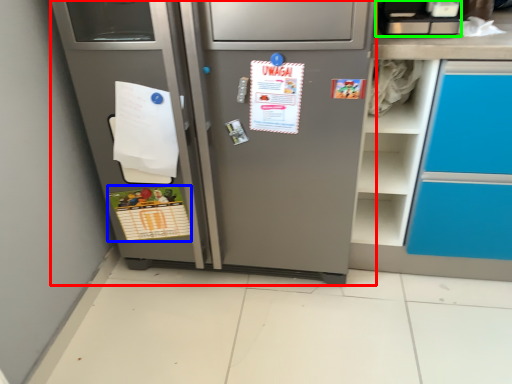
Question: Which object is positioned farthest from refrigerator (highlighted by a red box)? Select from postcard (highlighted by a blue box) and appliance (highlighted by a green box).

Choices:
 (A) postcard
 (B) appliance

Answer: (B)